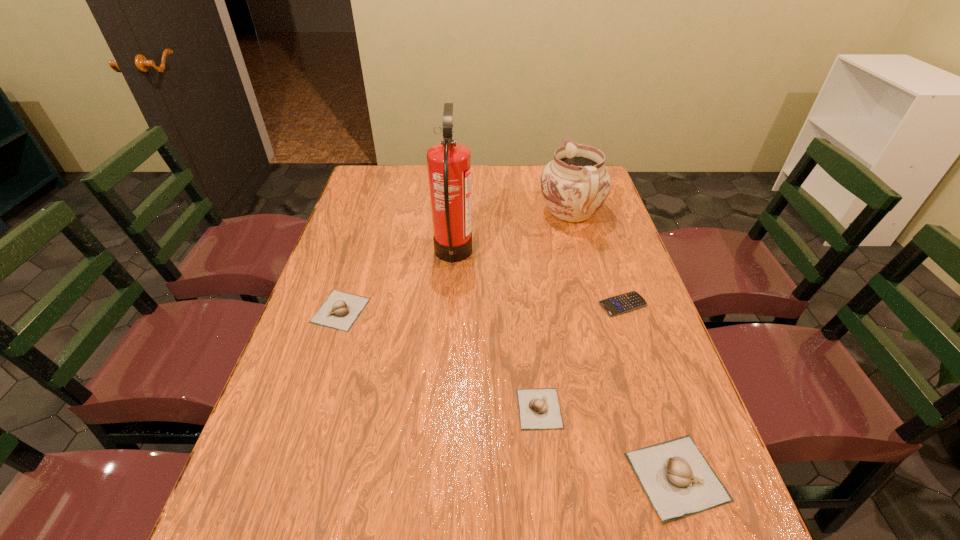
Locate an element on the screen. The height and width of the screenshot is (540, 960). vacant position for inserting another garlic evenly is located at coordinates (430, 354).